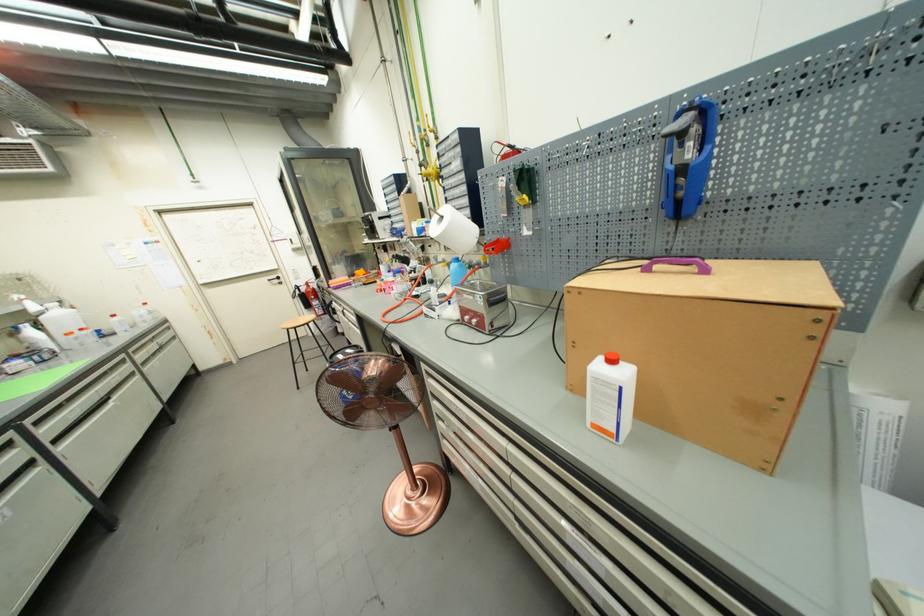
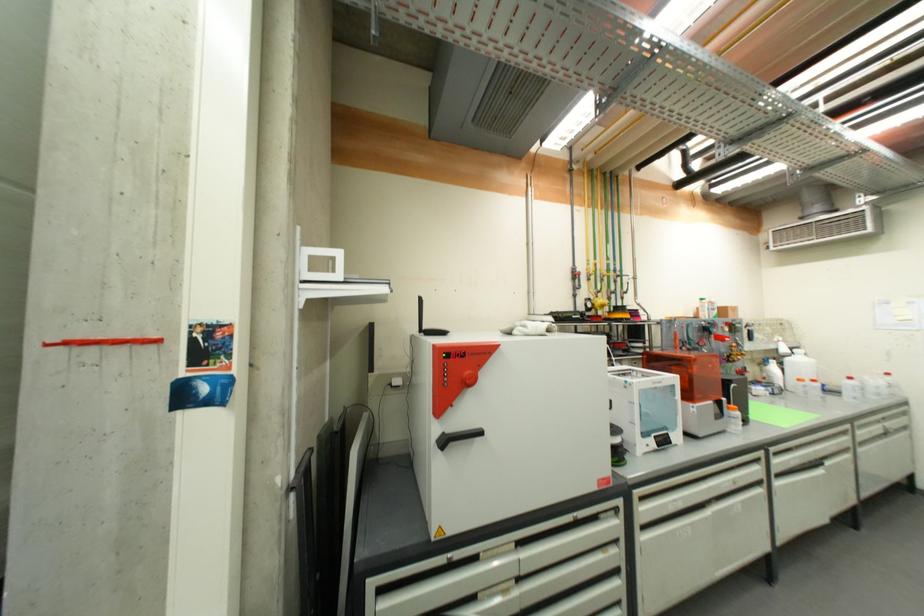
Question: Based on the continuous images, in which direction is the camera rotating? Reply with the corresponding letter.

Choices:
 (A) Left
 (B) Right
 (C) Up
 (D) Down

Answer: (A)